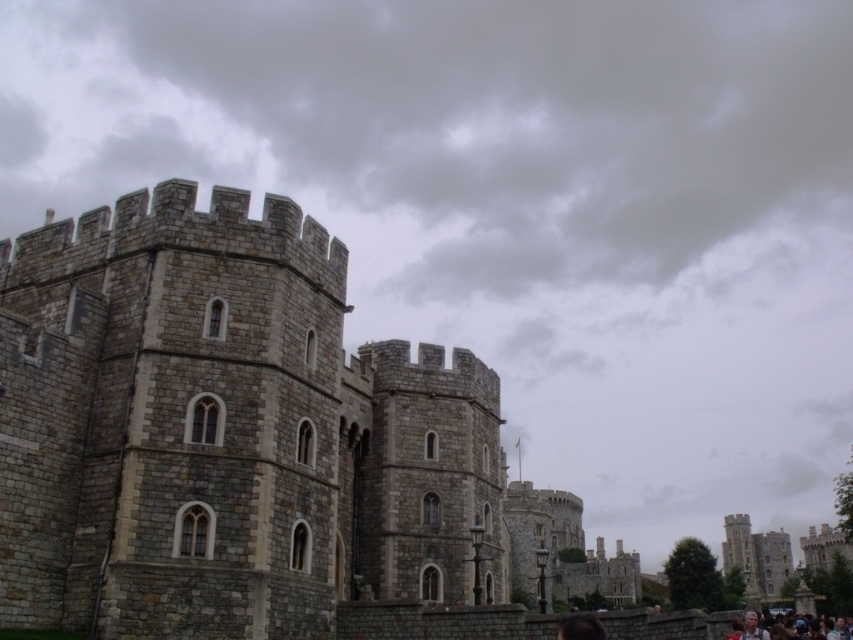
You are standing at the point labeled as point [233,435] in the image. Based on the scene description, what structure are you facing?

The point [233,435] corresponds to the stone castle at center, so you are facing the stone castle at center.

You are a photographer planning to take a picture of the stone castle at center and the light brown hair at lower right. Based on their positions, which object is closer to the camera?

The light brown hair at lower right is closer to the camera than the stone castle at center because it is positioned above the castle.